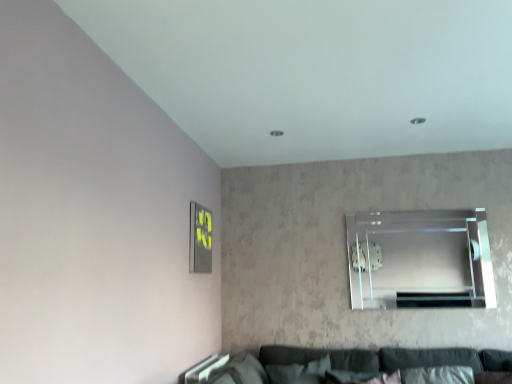
Image resolution: width=512 pixels, height=384 pixels. What do you see at coordinates (420, 259) in the screenshot? I see `clear glass window at upper right` at bounding box center [420, 259].

Where is `clear glass window at upper right`? clear glass window at upper right is located at coordinates (420, 259).

Identify the location of metallic gray picture frame at lower left. The image size is (512, 384). (200, 239).

Describe the element at coordinates (200, 239) in the screenshot. I see `metallic gray picture frame at lower left` at that location.

You are a GUI agent. You are given a task and a screenshot of the screen. Output one action in this format:
    pyautogui.click(x=<x>, y=<y>)
    Task: Click on the clear glass window at upper right
    The image size is (512, 384).
    Given the screenshot: What is the action you would take?
    point(420,259)

Which is more to the left, clear glass window at upper right or metallic gray picture frame at lower left?

metallic gray picture frame at lower left.

Relative to metallic gray picture frame at lower left, is clear glass window at upper right in front or behind?

In the image, clear glass window at upper right appears behind metallic gray picture frame at lower left.

Is point (422, 298) less distant than point (198, 267)?

No, (422, 298) is behind (198, 267).

From the image's perspective, between clear glass window at upper right and metallic gray picture frame at lower left, who is located below?

From the image's view, clear glass window at upper right is below.

From a real-world perspective, is clear glass window at upper right positioned above or below metallic gray picture frame at lower left?

clear glass window at upper right is situated lower than metallic gray picture frame at lower left in the real world.

From the picture: Which object is thinner, clear glass window at upper right or metallic gray picture frame at lower left?

clear glass window at upper right is thinner.

Is clear glass window at upper right taller than metallic gray picture frame at lower left?

Indeed, clear glass window at upper right has a greater height compared to metallic gray picture frame at lower left.

Does clear glass window at upper right have a smaller size compared to metallic gray picture frame at lower left?

Actually, clear glass window at upper right might be larger than metallic gray picture frame at lower left.

Is clear glass window at upper right surrounding metallic gray picture frame at lower left?

Definitely not — metallic gray picture frame at lower left is not inside clear glass window at upper right.

Is clear glass window at upper right beside metallic gray picture frame at lower left?

No, clear glass window at upper right is not touching metallic gray picture frame at lower left.

Could you tell me if clear glass window at upper right is facing metallic gray picture frame at lower left?

No, clear glass window at upper right is not turned towards metallic gray picture frame at lower left.

Where is `window directly beneath the metallic gray picture frame at lower left (from a real-world perspective)`? The height and width of the screenshot is (384, 512). window directly beneath the metallic gray picture frame at lower left (from a real-world perspective) is located at coordinates (420, 259).

Consider the image. Would you say metallic gray picture frame at lower left is to the left or to the right of clear glass window at upper right in the picture?

From the image, it's evident that metallic gray picture frame at lower left is to the left of clear glass window at upper right.

Is the depth of metallic gray picture frame at lower left less than that of clear glass window at upper right?

Yes.

Between point (192, 236) and point (421, 230), which one is positioned behind?

Point (421, 230)

From the image's perspective, which one is positioned lower, metallic gray picture frame at lower left or clear glass window at upper right?

clear glass window at upper right is shown below in the image.

From a real-world perspective, is metallic gray picture frame at lower left located higher than clear glass window at upper right?

Yes, from a real-world perspective, metallic gray picture frame at lower left is over clear glass window at upper right

Is metallic gray picture frame at lower left wider or thinner than clear glass window at upper right?

Considering their sizes, metallic gray picture frame at lower left looks broader than clear glass window at upper right.

Is metallic gray picture frame at lower left taller than clear glass window at upper right?

In fact, metallic gray picture frame at lower left may be shorter than clear glass window at upper right.

Between metallic gray picture frame at lower left and clear glass window at upper right, which one has larger size?

With larger size is clear glass window at upper right.

Is clear glass window at upper right surrounded by metallic gray picture frame at lower left?

No, clear glass window at upper right is not inside metallic gray picture frame at lower left.

Is the surface of metallic gray picture frame at lower left in direct contact with clear glass window at upper right?

No.

Is metallic gray picture frame at lower left looking in the opposite direction of clear glass window at upper right?

That's not correct — metallic gray picture frame at lower left is not looking away from clear glass window at upper right.

What's the angular difference between metallic gray picture frame at lower left and clear glass window at upper right's facing directions?

The angular difference between metallic gray picture frame at lower left and clear glass window at upper right is 89.2 degrees.

The height and width of the screenshot is (384, 512). I want to click on picture frame above the clear glass window at upper right (from a real-world perspective), so click(x=200, y=239).

You are a GUI agent. You are given a task and a screenshot of the screen. Output one action in this format:
    pyautogui.click(x=<x>, y=<y>)
    Task: Click on the picture frame in front of the clear glass window at upper right
    
    Given the screenshot: What is the action you would take?
    pyautogui.click(x=200, y=239)

Locate an element on the screen. The height and width of the screenshot is (384, 512). window that appears behind the metallic gray picture frame at lower left is located at coordinates (420, 259).